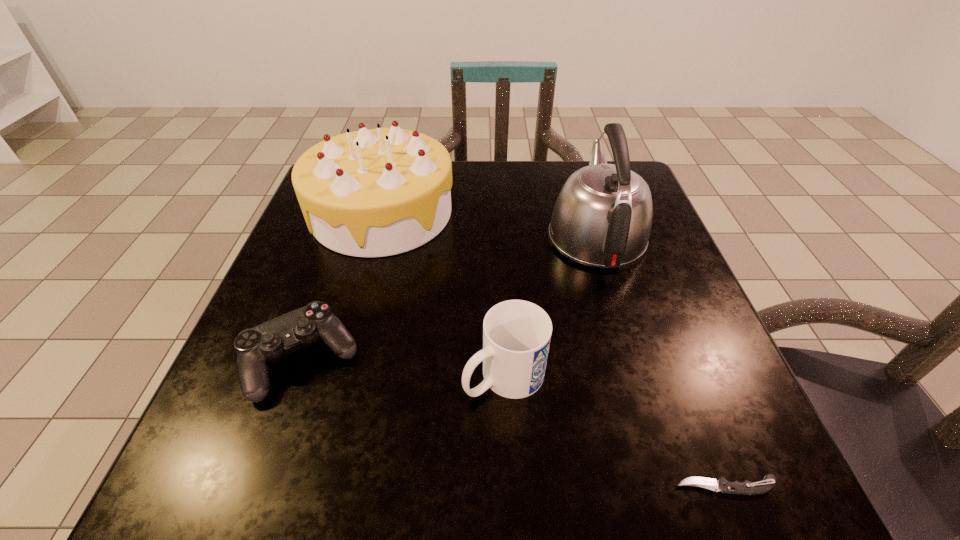
At what (x,y) coordinates should I click in order to perform the action: click on object situated at the far right corner. Please return your answer as a coordinate pair (x, y). The width and height of the screenshot is (960, 540). Looking at the image, I should click on (602, 217).

At what (x,y) coordinates should I click in order to perform the action: click on object situated at the near right corner. Please return your answer as a coordinate pair (x, y). Image resolution: width=960 pixels, height=540 pixels. Looking at the image, I should click on (746, 487).

At what (x,y) coordinates should I click in order to perform the action: click on vacant space at the far edge of the desktop. Please return your answer as a coordinate pair (x, y). This screenshot has width=960, height=540. Looking at the image, I should click on (462, 168).

In the image, there is a desktop. Where is `vacant region at the near edge`? The image size is (960, 540). vacant region at the near edge is located at coordinates (428, 467).

In the image, there is a desktop. Identify the location of vacant region at the left edge. [x=319, y=247].

In the image, there is a desktop. Where is `blank space at the right edge`? The image size is (960, 540). blank space at the right edge is located at coordinates (646, 341).

Locate an element on the screen. This screenshot has width=960, height=540. free region at the near left corner is located at coordinates (306, 456).

The image size is (960, 540). I want to click on vacant space at the near right corner, so click(673, 454).

Locate an element on the screen. vacant region between the pocketknife and the third object from right to left is located at coordinates pyautogui.click(x=615, y=431).

This screenshot has height=540, width=960. Find the location of `empty space that is in between the fourth shortest object and the third object from left to right`. empty space that is in between the fourth shortest object and the third object from left to right is located at coordinates (444, 294).